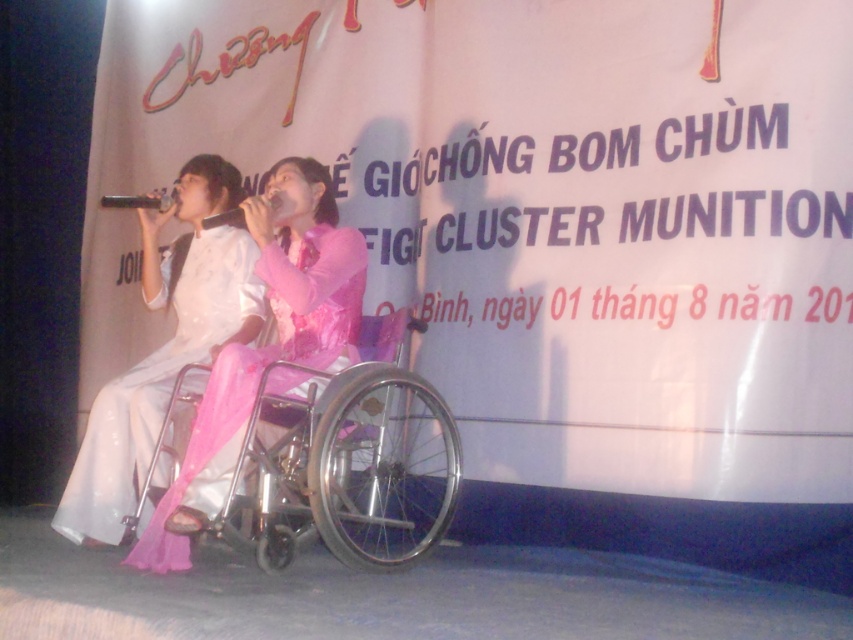
Question: Among these objects, which one is farthest from the camera?

Choices:
 (A) pink satin dress at center
 (B) white satin dress at center
 (C) matte black microphone at center
 (D) silver metallic wheelchair at center

Answer: (B)

Question: Which object is the closest to the silver metallic wheelchair at center?

Choices:
 (A) metallic silver microphone at center
 (B) matte black microphone at center
 (C) pink satin dress at center

Answer: (C)

Question: Does silver metallic wheelchair at center appear on the right side of matte black microphone at center?

Choices:
 (A) yes
 (B) no

Answer: (A)

Question: Which object is the closest to the matte black microphone at center?

Choices:
 (A) white satin dress at center
 (B) metallic silver microphone at center

Answer: (B)

Question: Considering the relative positions of white satin dress at center and pink satin dress at center in the image provided, where is white satin dress at center located with respect to pink satin dress at center?

Choices:
 (A) below
 (B) above

Answer: (A)

Question: Does silver metallic wheelchair at center appear under pink satin dress at center?

Choices:
 (A) yes
 (B) no

Answer: (A)